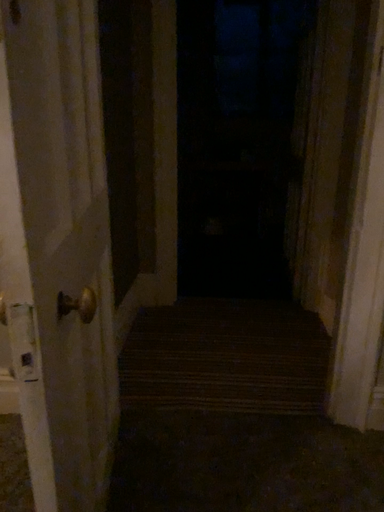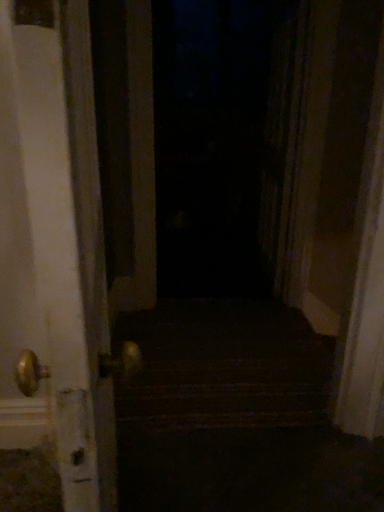
Question: How did the camera likely rotate when shooting the video?

Choices:
 (A) rotated right
 (B) rotated left

Answer: (A)